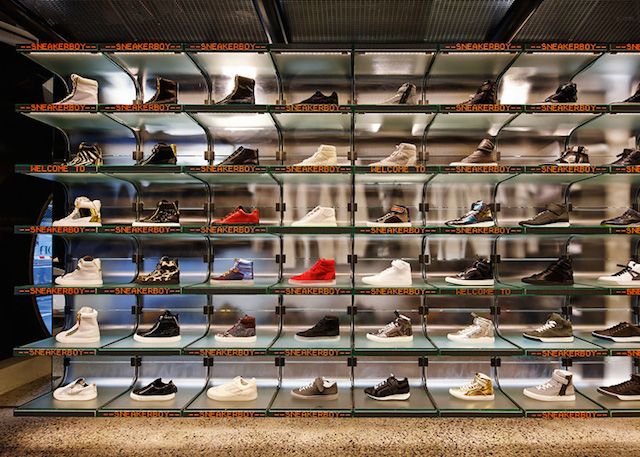
This screenshot has height=457, width=640. Identify the location of 2nd shelve. (63, 350), (137, 350), (228, 349), (298, 350), (390, 350), (461, 348), (547, 352), (623, 348).